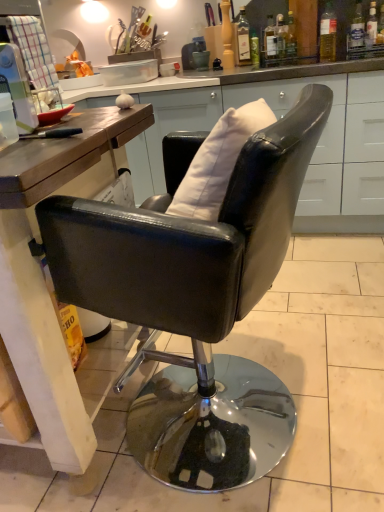
Locate an element on the screen. This screenshot has width=384, height=512. free space in front of translucent glass bottle at upper right, the fourth bottle in the right-to-left sequence is located at coordinates click(295, 62).